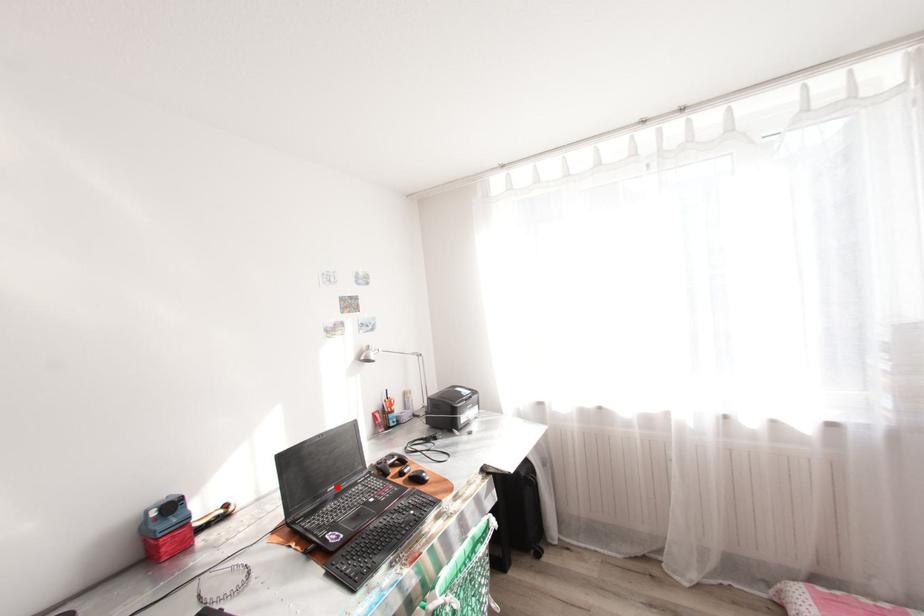
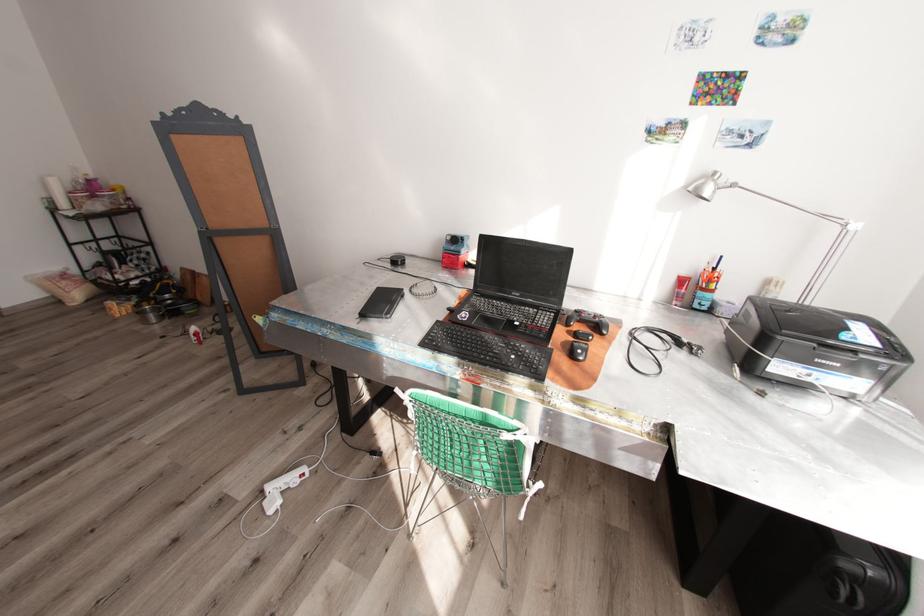
Where in the second image is the point corresponding to the highlighted location from the first image?

(523, 294)